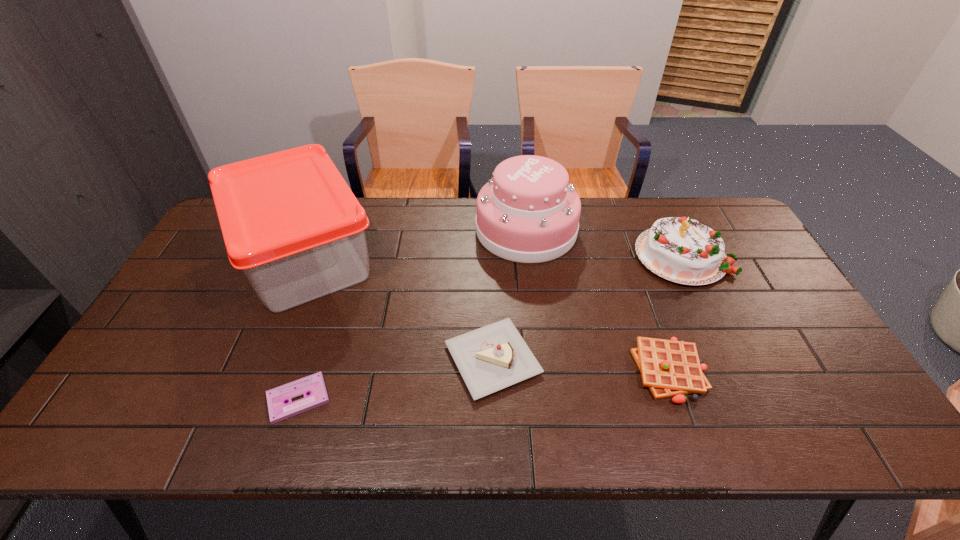
Locate an element on the screen. The width and height of the screenshot is (960, 540). vacant area in the image that satisfies the following two spatial constraints: 1. on the back side of the nearest cake; 2. on the left side of the tallest cake is located at coordinates (490, 230).

Identify the location of free space that satisfies the following two spatial constraints: 1. on the back side of the tallest cake; 2. on the left side of the tray. click(317, 230).